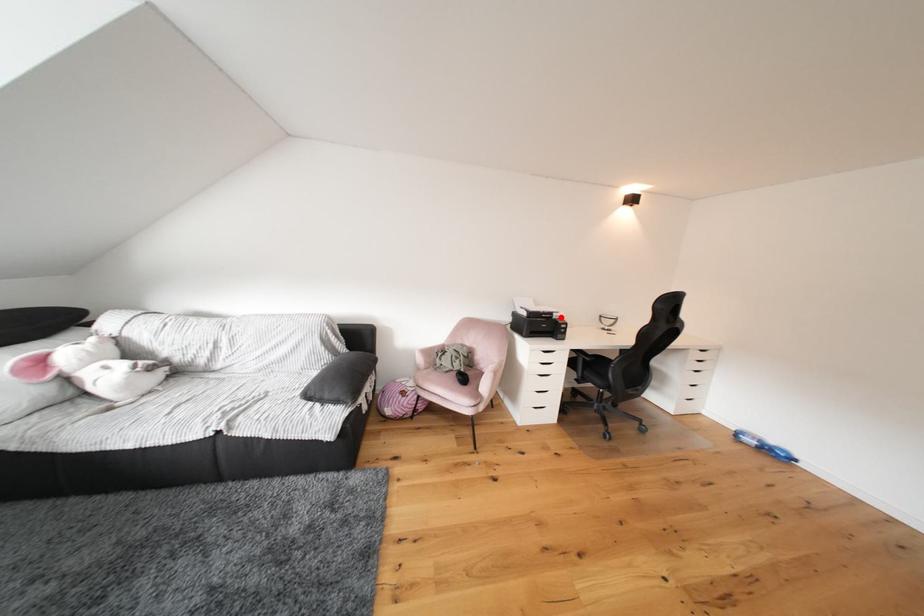
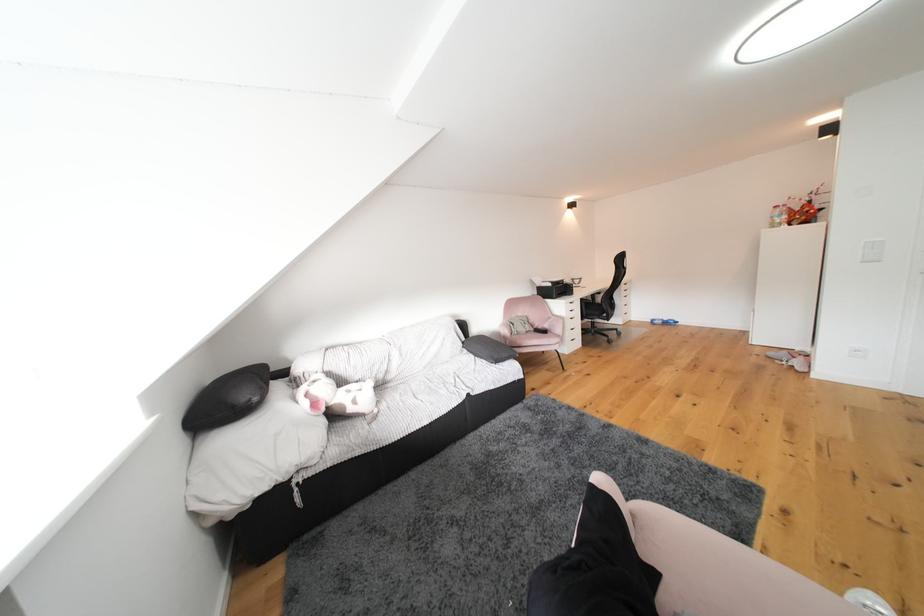
The point at the highlighted location is marked in the first image. Where is the corresponding point in the second image?

(572, 285)